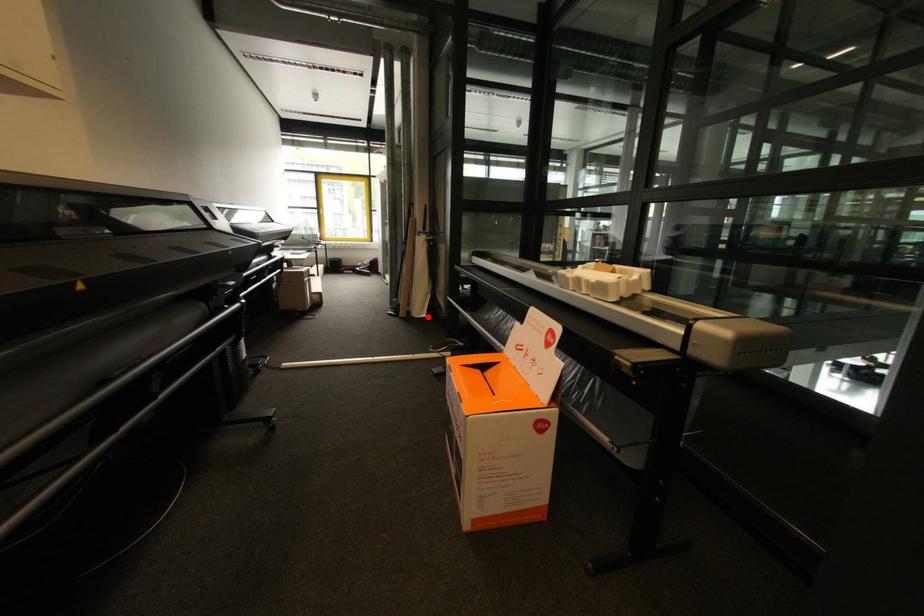
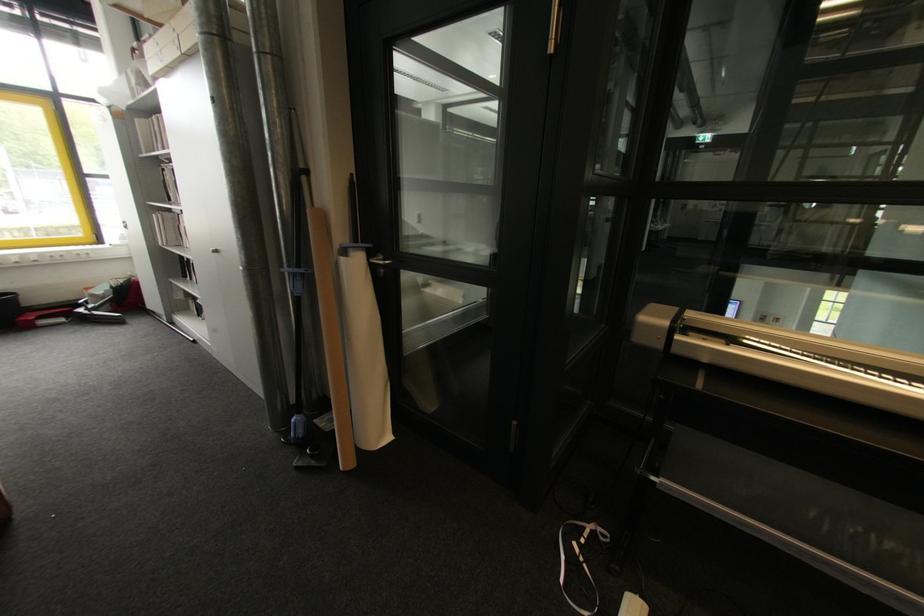
Question: A red point is marked in image1. In image2, is the corresponding 3D point closer to the camera or farther? Reply with the corresponding letter.

Choices:
 (A) The corresponding 3D point is closer.
 (B) The corresponding 3D point is farther.

Answer: (A)